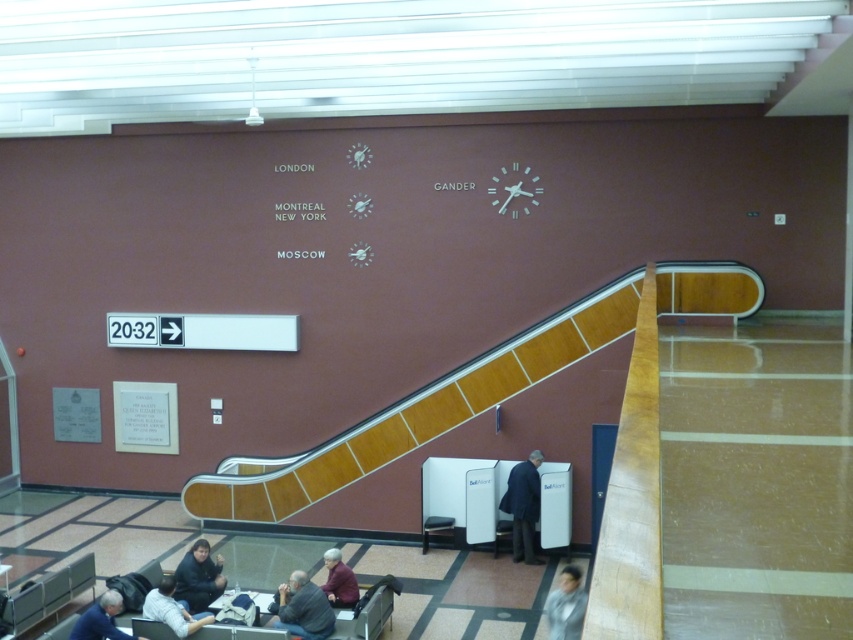
Does point (312, 618) lie behind point (579, 612)?

Yes, point (312, 618) is behind point (579, 612).

Is dark gray sweater at lower center behind gray fabric jacket at lower right?

That is True.

You are a GUI agent. You are given a task and a screenshot of the screen. Output one action in this format:
    pyautogui.click(x=<x>, y=<y>)
    Task: Click on the dark gray sweater at lower center
    
    Given the screenshot: What is the action you would take?
    pyautogui.click(x=302, y=609)

Is dark gray sweater at lower center wider than dark gray sweater at lower left?

Correct, the width of dark gray sweater at lower center exceeds that of dark gray sweater at lower left.

Can you confirm if dark gray sweater at lower center is positioned below dark gray sweater at lower left?

Correct, dark gray sweater at lower center is located below dark gray sweater at lower left.

This screenshot has height=640, width=853. I want to click on dark gray sweater at lower center, so click(302, 609).

Find the location of a particular element. The image size is (853, 640). dark gray sweater at lower center is located at coordinates (302, 609).

Can you confirm if dark gray sweater at lower center is thinner than dark gray suit at center?

No.

Does dark gray sweater at lower center have a lesser height compared to dark gray suit at center?

Yes.

This screenshot has width=853, height=640. Find the location of `dark gray sweater at lower center`. dark gray sweater at lower center is located at coordinates (302, 609).